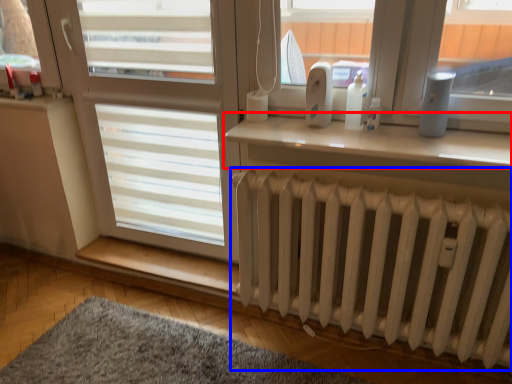
Question: Which point is further to the camera, window (highlighted by a red box) or radiator (highlighted by a blue box)?

Choices:
 (A) window
 (B) radiator

Answer: (A)